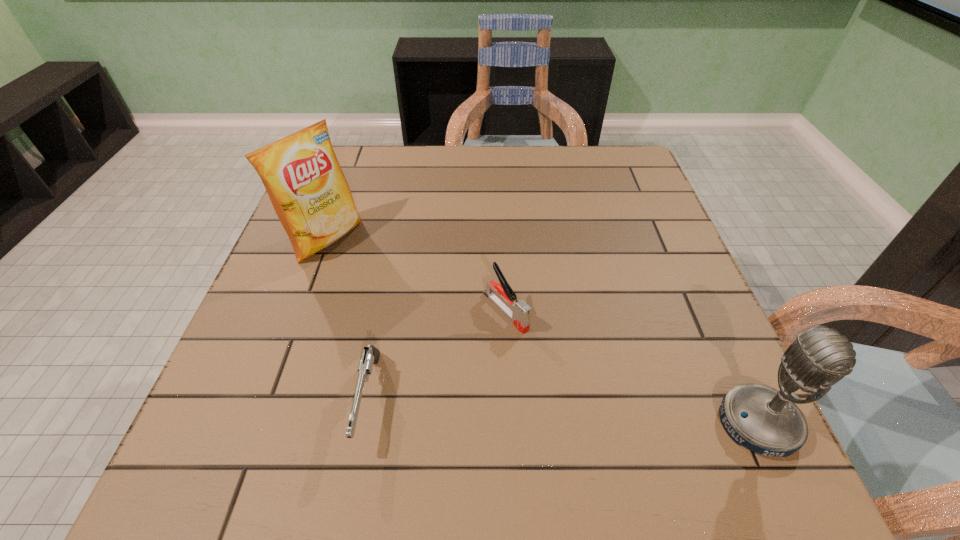
At what (x,y) coordinates should I click in order to perform the action: click on free point located 0.170m on the handle side of the stapler. Please return your answer as a coordinate pair (x, y). The image size is (960, 540). Looking at the image, I should click on (585, 392).

Where is `vacant space situated 0.100m on the handle side of the stapler`? Image resolution: width=960 pixels, height=540 pixels. vacant space situated 0.100m on the handle side of the stapler is located at coordinates (556, 364).

Where is `free space located 0.180m on the handle side of the stapler`? The width and height of the screenshot is (960, 540). free space located 0.180m on the handle side of the stapler is located at coordinates [x=588, y=395].

Where is `pistol that is at the near edge`? Image resolution: width=960 pixels, height=540 pixels. pistol that is at the near edge is located at coordinates (371, 355).

I want to click on microphone that is at the near edge, so click(x=764, y=420).

Where is `object located in the left edge section of the desktop`? This screenshot has height=540, width=960. object located in the left edge section of the desktop is located at coordinates (301, 174).

This screenshot has height=540, width=960. Find the location of `object that is at the right edge`. object that is at the right edge is located at coordinates (764, 420).

Find the location of a particular element. This screenshot has height=540, width=960. object at the near right corner is located at coordinates (764, 420).

You are a GUI agent. You are given a task and a screenshot of the screen. Output one action in this format:
    pyautogui.click(x=<x>, y=<y>)
    Task: Click on the vacant space at the far edge
    This screenshot has width=960, height=540.
    Given the screenshot: What is the action you would take?
    pyautogui.click(x=428, y=185)

The width and height of the screenshot is (960, 540). What are the coordinates of `vacant space at the near edge of the desktop` in the screenshot? It's located at (396, 401).